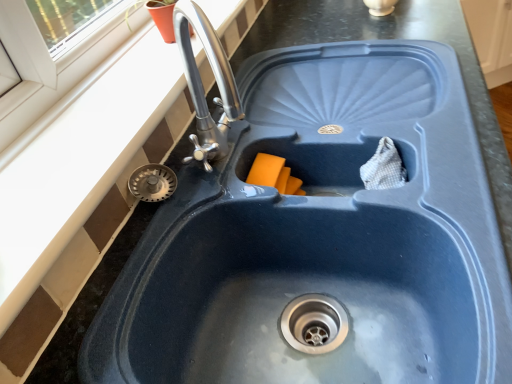
Where is `white matte window sill at upper left`? The image size is (512, 384). white matte window sill at upper left is located at coordinates (78, 160).

What do you see at coordinates (78, 160) in the screenshot? I see `white matte window sill at upper left` at bounding box center [78, 160].

Find the location of a particular element. white matte window sill at upper left is located at coordinates (78, 160).